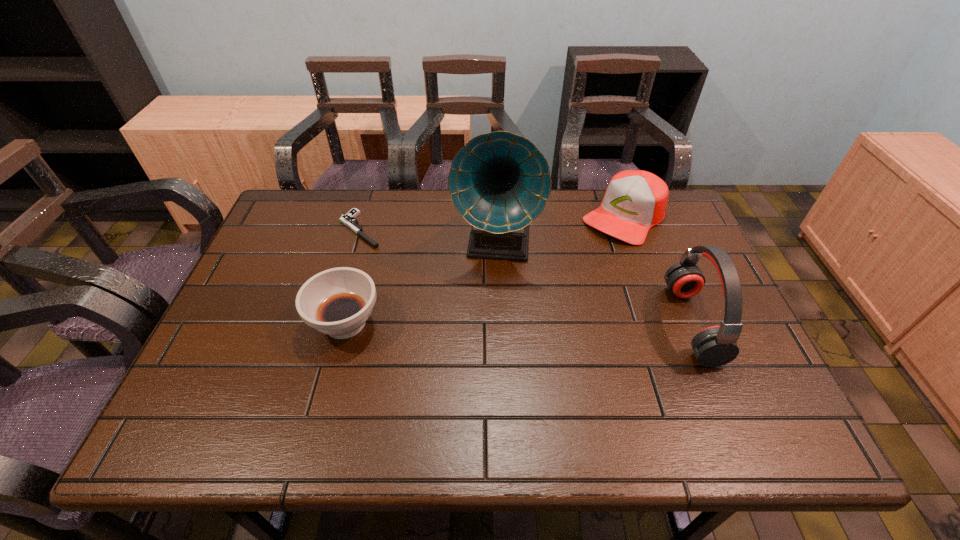
Where is `free space on the desktop that is between the fourth tallest object and the fourth shortest object and is positioned from the horn of the phonograph_record`? The width and height of the screenshot is (960, 540). free space on the desktop that is between the fourth tallest object and the fourth shortest object and is positioned from the horn of the phonograph_record is located at coordinates (487, 323).

Where is `free space on the desktop that is between the second shortest object and the second tallest object and is positioned on the front-facing side of the shortest object`? free space on the desktop that is between the second shortest object and the second tallest object and is positioned on the front-facing side of the shortest object is located at coordinates (486, 323).

At what (x,y) coordinates should I click in order to perform the action: click on free spot on the desktop that is between the fourth tallest object and the earphone and is positioned on the front-facing side of the baseball cap. Please return your answer as a coordinate pair (x, y). This screenshot has height=540, width=960. Looking at the image, I should click on (526, 323).